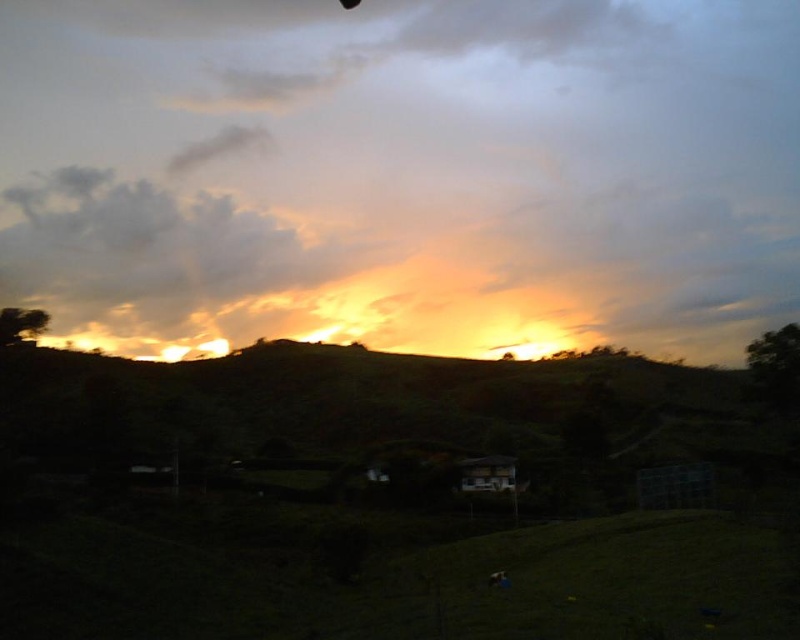
Based on the photo, you are an artist painting the sunset scene. You need to decide which area of the sky to focus on first based on their sizes. Which sky area has a smaller width between the cloudy orange sky at upper center and the cloudy sky at upper center?

The cloudy orange sky at upper center has a lesser width compared to cloudy sky at upper center, so it is the smaller one.